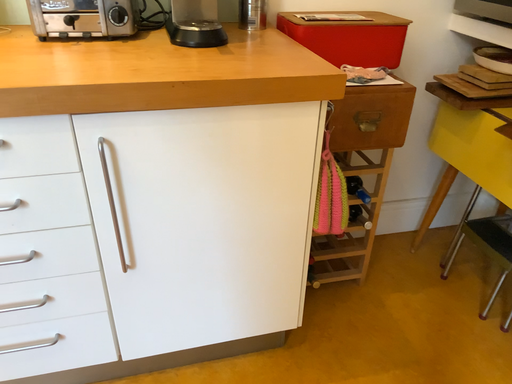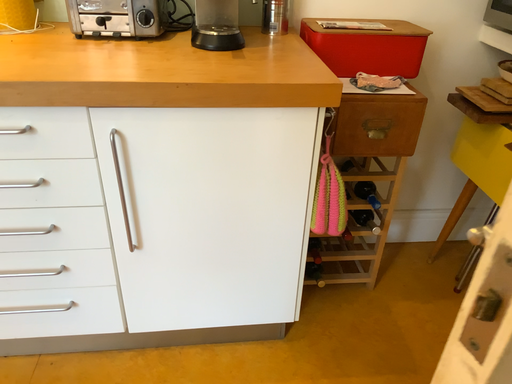
Question: Which way did the camera rotate in the video?

Choices:
 (A) rotated right
 (B) rotated left

Answer: (B)